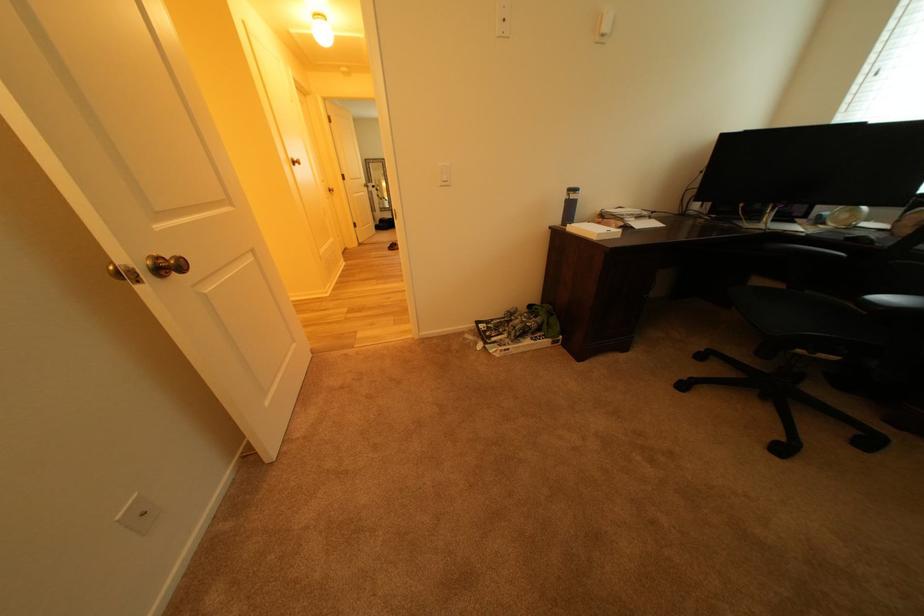
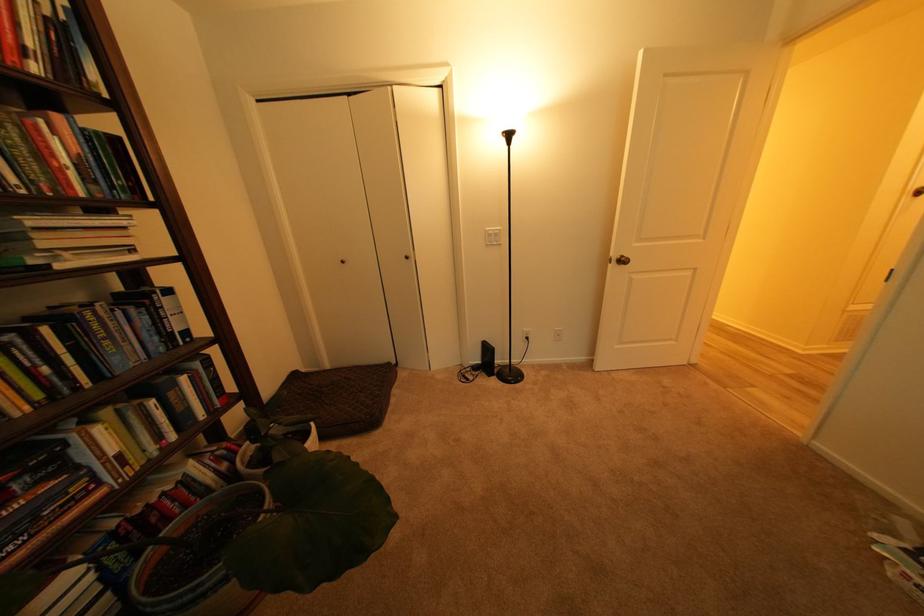
Locate, in the second image, the point that corresponds to point (149, 283) in the first image.

(621, 265)